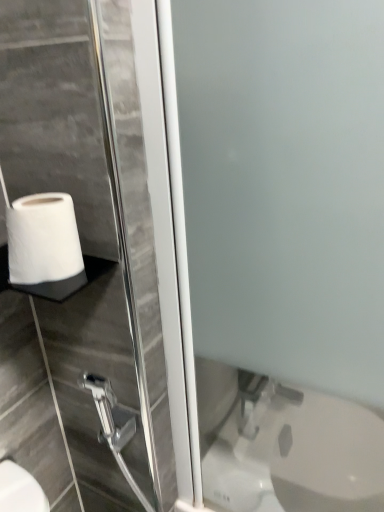
Question: From a real-world perspective, is white matte toilet paper at lower left positioned over frosted glass screen door at center based on gravity?

Choices:
 (A) no
 (B) yes

Answer: (B)

Question: Is white matte toilet paper at lower left facing towards frosted glass screen door at center?

Choices:
 (A) yes
 (B) no

Answer: (B)

Question: From a real-world perspective, is white matte toilet paper at lower left positioned under frosted glass screen door at center based on gravity?

Choices:
 (A) yes
 (B) no

Answer: (B)

Question: Would you say frosted glass screen door at center is part of white matte toilet paper at lower left's contents?

Choices:
 (A) yes
 (B) no

Answer: (B)

Question: Does white matte toilet paper at lower left have a lesser width compared to frosted glass screen door at center?

Choices:
 (A) no
 (B) yes

Answer: (A)

Question: From the image's perspective, is white matte toilet paper at lower left over frosted glass screen door at center?

Choices:
 (A) no
 (B) yes

Answer: (B)

Question: Would you consider frosted glass screen door at center to be distant from white matte toilet paper at lower left?

Choices:
 (A) no
 (B) yes

Answer: (A)

Question: Are frosted glass screen door at center and white matte toilet paper at lower left making contact?

Choices:
 (A) yes
 (B) no

Answer: (B)

Question: Is frosted glass screen door at center thinner than white matte toilet paper at lower left?

Choices:
 (A) no
 (B) yes

Answer: (B)

Question: Can you confirm if frosted glass screen door at center is positioned to the left of white matte toilet paper at lower left?

Choices:
 (A) yes
 (B) no

Answer: (B)

Question: From the image's perspective, does frosted glass screen door at center appear lower than white matte toilet paper at lower left?

Choices:
 (A) no
 (B) yes

Answer: (B)

Question: Is frosted glass screen door at center turned away from white matte toilet paper at lower left?

Choices:
 (A) no
 (B) yes

Answer: (A)

Question: Is white matte toilet paper at lower left surrounded by metallic silver shower head at lower left?

Choices:
 (A) no
 (B) yes

Answer: (A)